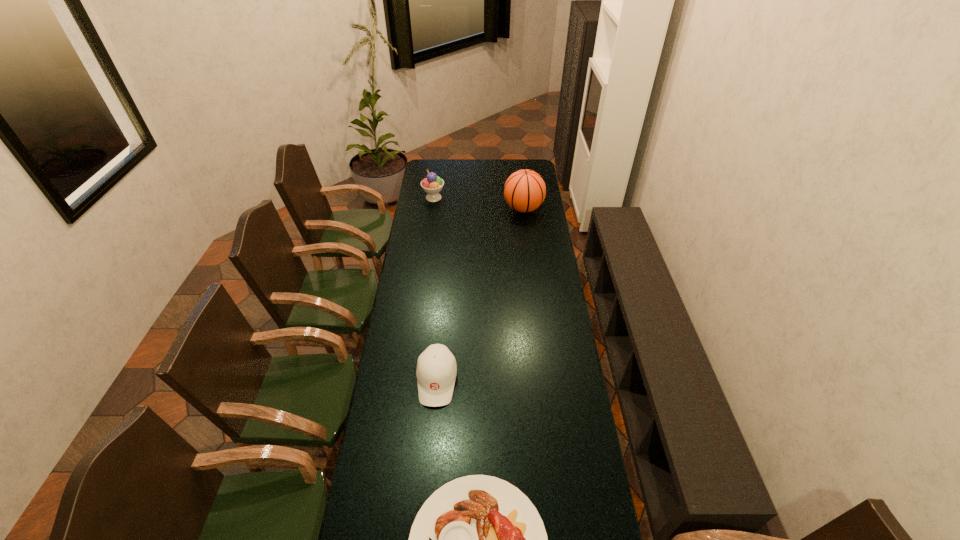
The height and width of the screenshot is (540, 960). What are the coordinates of `vacant point that satisfies the following two spatial constraints: 1. on the front side of the basketball; 2. on the left side of the second tallest object` in the screenshot? It's located at (432, 208).